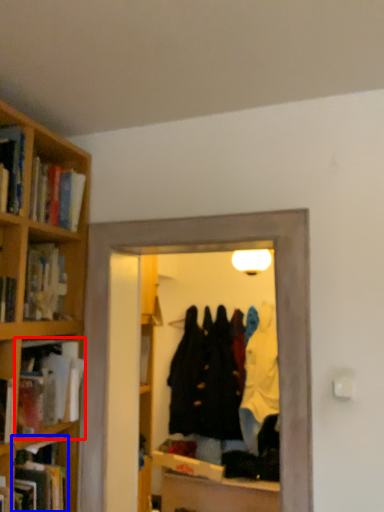
Question: Which object is further to the camera taking this photo, book (highlighted by a red box) or book (highlighted by a blue box)?

Choices:
 (A) book
 (B) book

Answer: (A)